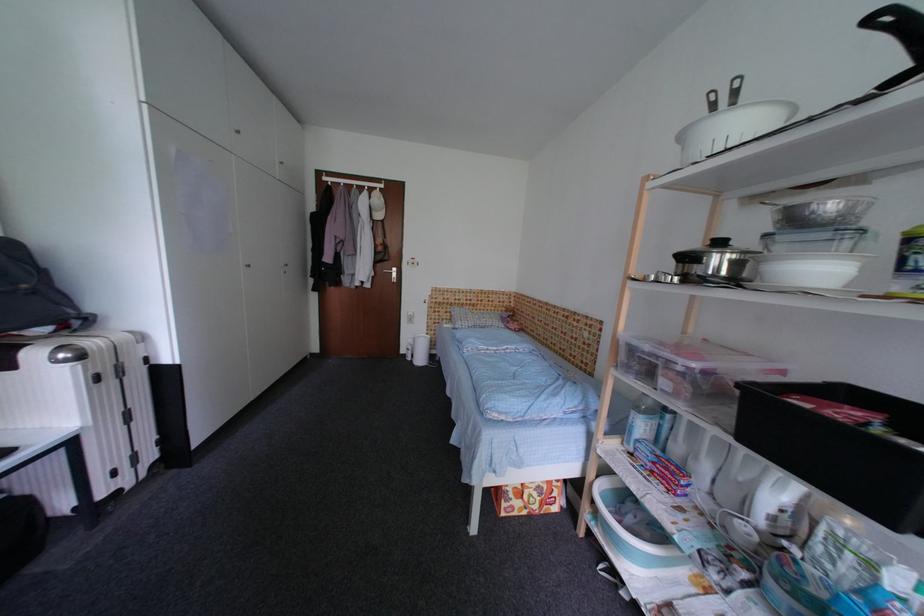
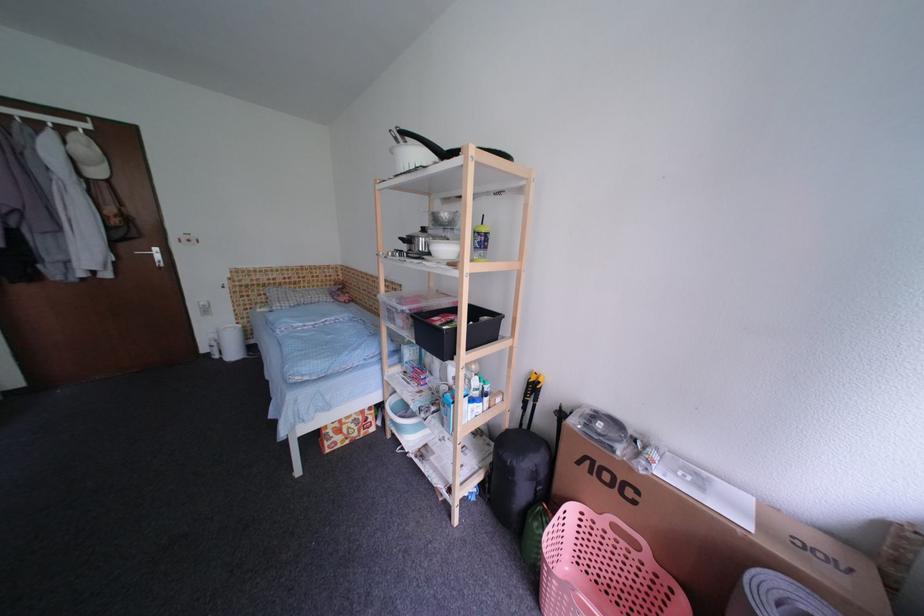
In the second image, find the point that corresponds to the point at 593,517 in the first image.

(395, 426)